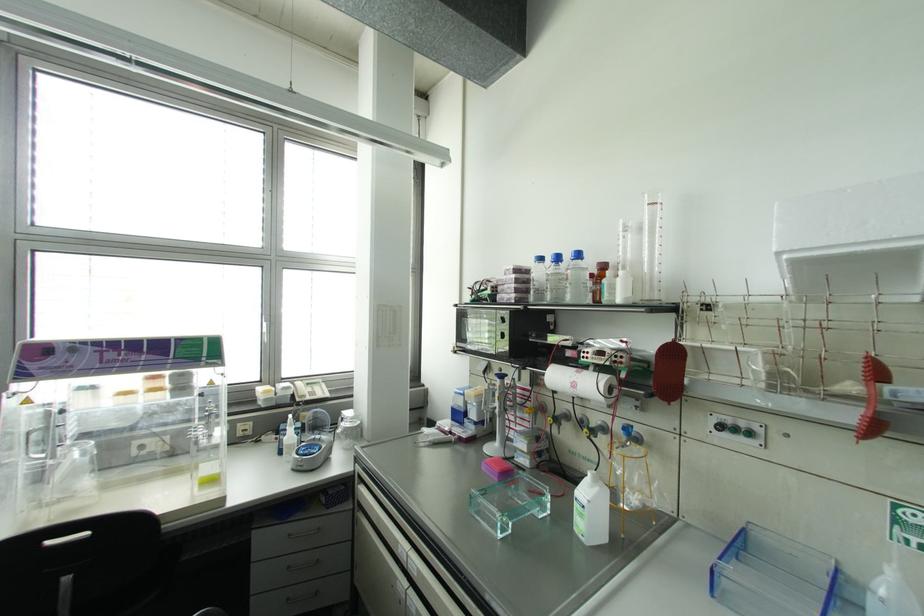
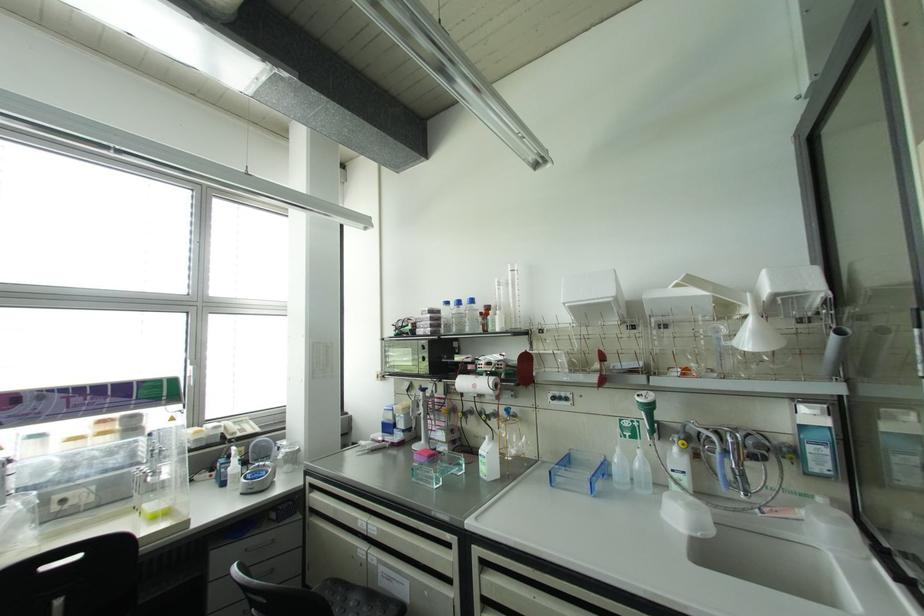
In the second image, find the point that corresponds to point (578, 254) in the first image.

(471, 301)